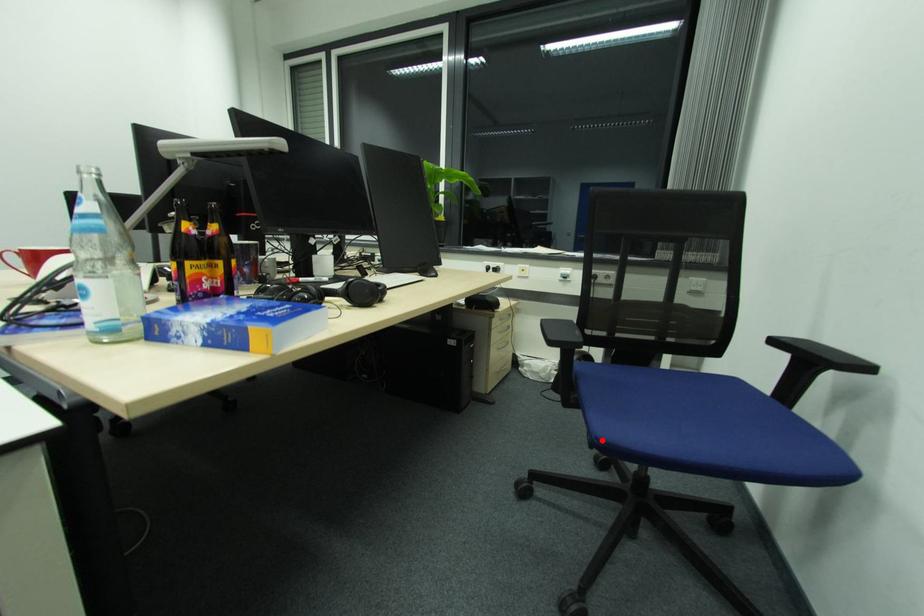
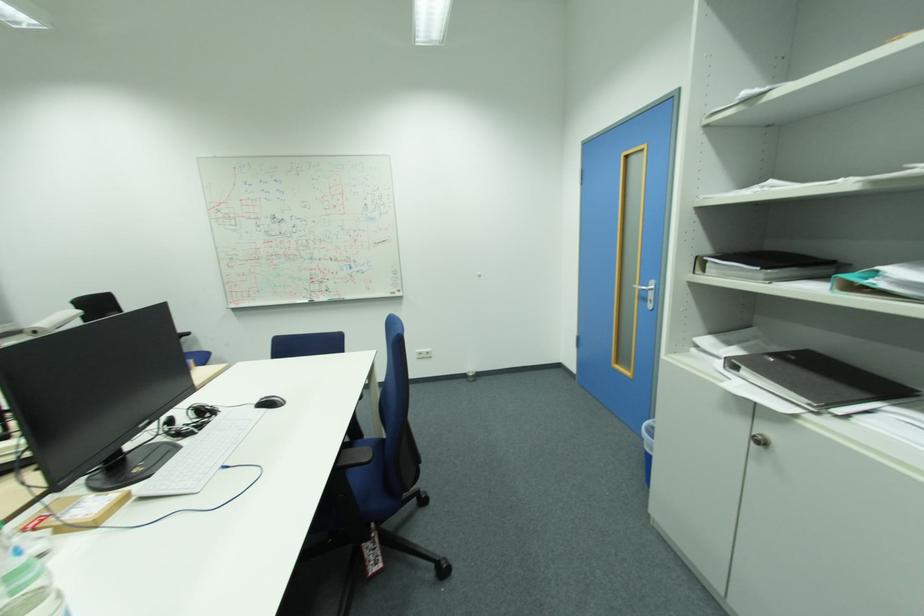
Question: I am providing you with two images of the same scene from different viewpoints. A red point is marked on the first image. Is the red point's position out of view in image 2?

Choices:
 (A) Yes
 (B) No

Answer: (A)